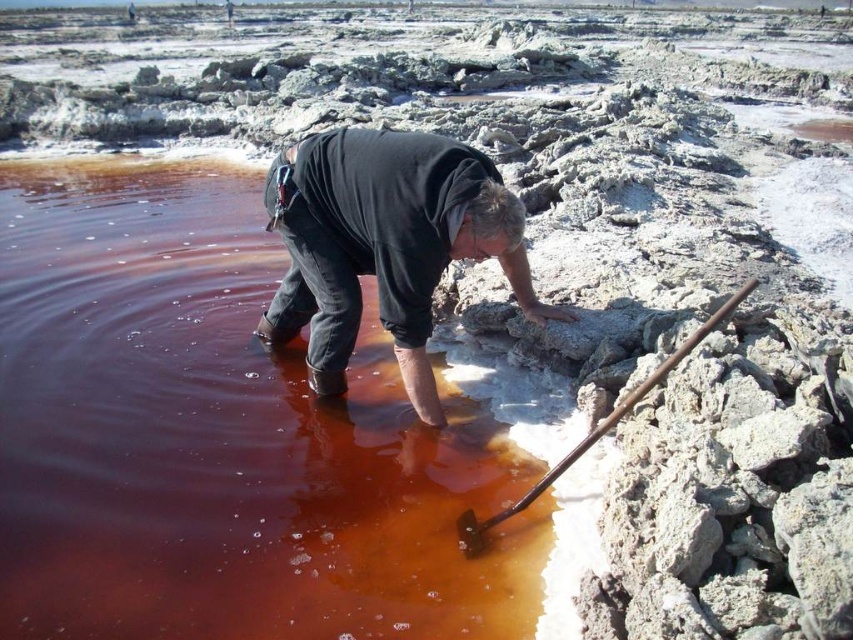
Question: From the image, what is the correct spatial relationship of brown liquid at lower left in relation to black cotton shirt at center?

Choices:
 (A) left
 (B) right

Answer: (A)

Question: Which is farther from the black cotton shirt at center?

Choices:
 (A) rusty metal shovel at lower right
 (B) brown liquid at lower left

Answer: (A)

Question: Can you confirm if brown liquid at lower left is positioned below black cotton shirt at center?

Choices:
 (A) yes
 (B) no

Answer: (A)

Question: Which point is farther to the camera?

Choices:
 (A) (601, 428)
 (B) (112, 476)

Answer: (B)

Question: Is black cotton shirt at center positioned at the back of rusty metal shovel at lower right?

Choices:
 (A) yes
 (B) no

Answer: (A)

Question: Estimate the real-world distances between objects in this image. Which object is farther from the rusty metal shovel at lower right?

Choices:
 (A) black cotton shirt at center
 (B) brown liquid at lower left

Answer: (B)